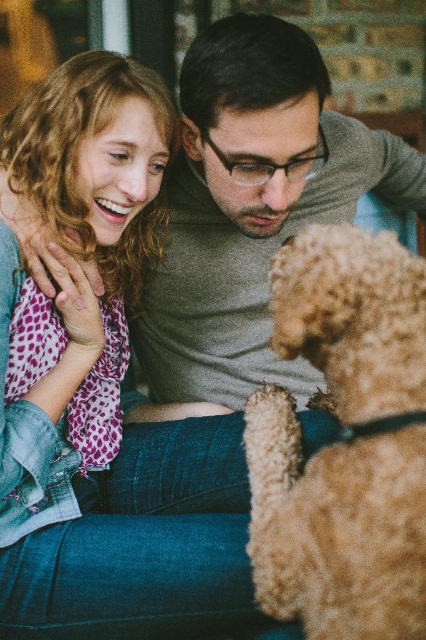
Question: Which point is farther to the camera?

Choices:
 (A) matte pink scarf at upper left
 (B) gray matte sweater at center

Answer: (B)

Question: Does matte pink scarf at upper left appear over fuzzy golden dog at lower right?

Choices:
 (A) yes
 (B) no

Answer: (A)

Question: Can you confirm if matte pink scarf at upper left is positioned to the left of gray matte sweater at center?

Choices:
 (A) no
 (B) yes

Answer: (B)

Question: Which object is closer to the camera taking this photo?

Choices:
 (A) gray matte sweater at center
 (B) matte pink scarf at upper left

Answer: (B)

Question: Which point is farther from the camera taking this photo?

Choices:
 (A) (376, 284)
 (B) (178, 220)

Answer: (B)

Question: Can you confirm if matte pink scarf at upper left is smaller than fuzzy golden dog at lower right?

Choices:
 (A) no
 (B) yes

Answer: (A)